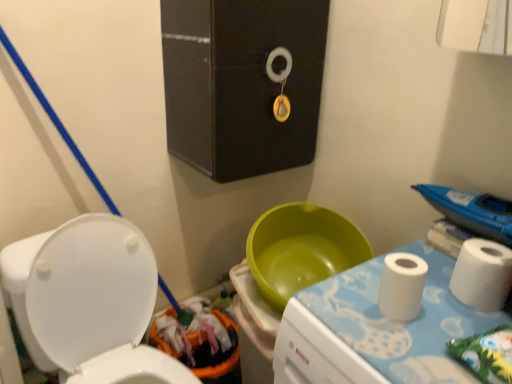
Question: Can you confirm if white glossy toilet at lower left is positioned to the left of white paper towel at right?

Choices:
 (A) yes
 (B) no

Answer: (A)

Question: Considering the relative sizes of white glossy toilet at lower left and white paper towel at right in the image provided, is white glossy toilet at lower left bigger than white paper towel at right?

Choices:
 (A) yes
 (B) no

Answer: (A)

Question: Does white glossy toilet at lower left appear on the right side of white paper towel at right?

Choices:
 (A) no
 (B) yes

Answer: (A)

Question: Is white glossy toilet at lower left smaller than white paper towel at right?

Choices:
 (A) yes
 (B) no

Answer: (B)

Question: Is white glossy toilet at lower left surrounding white paper towel at right?

Choices:
 (A) no
 (B) yes

Answer: (A)

Question: Is white glossy toilet at lower left placed right next to white paper towel at right?

Choices:
 (A) no
 (B) yes

Answer: (A)

Question: Would you say white fabric changing table at right is part of white matte toilet paper at right's contents?

Choices:
 (A) no
 (B) yes

Answer: (A)

Question: Is white matte toilet paper at right shorter than white fabric changing table at right?

Choices:
 (A) no
 (B) yes

Answer: (B)

Question: Does white matte toilet paper at right have a smaller size compared to white fabric changing table at right?

Choices:
 (A) no
 (B) yes

Answer: (B)

Question: From the image's perspective, is white matte toilet paper at right beneath white fabric changing table at right?

Choices:
 (A) yes
 (B) no

Answer: (B)

Question: Is white matte toilet paper at right thinner than white fabric changing table at right?

Choices:
 (A) yes
 (B) no

Answer: (A)

Question: Is white matte toilet paper at right at the left side of white fabric changing table at right?

Choices:
 (A) no
 (B) yes

Answer: (A)

Question: Does black matte medicine cabinet at upper center have a larger size compared to white matte toilet paper at right?

Choices:
 (A) no
 (B) yes

Answer: (B)